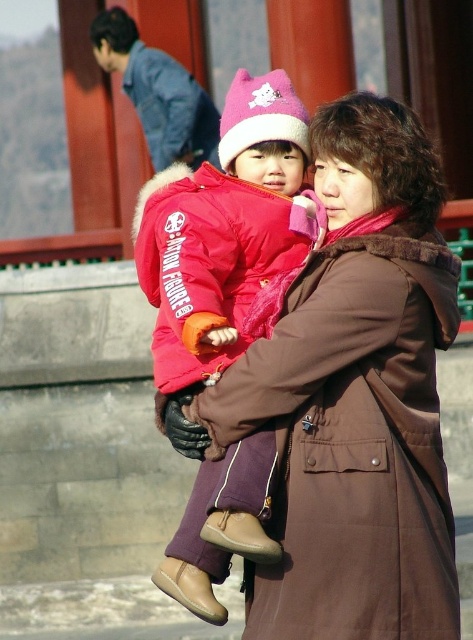
Which is behind, point (352, 328) or point (134, 248)?

The point (134, 248) is more distant.

I want to click on brown matte coat at center, so click(x=352, y=444).

Between matte red jacket at center and matte pink jacket at center, which one has less height?

With less height is matte pink jacket at center.

Does matte red jacket at center appear over matte pink jacket at center?

Incorrect, matte red jacket at center is not positioned above matte pink jacket at center.

This screenshot has height=640, width=473. What do you see at coordinates (226, 230) in the screenshot?
I see `matte red jacket at center` at bounding box center [226, 230].

I want to click on matte red jacket at center, so (226, 230).

Image resolution: width=473 pixels, height=640 pixels. In order to click on brown matte coat at center in this screenshot , I will do `click(352, 444)`.

Who is taller, brown matte coat at center or matte red jacket at center?

matte red jacket at center

The width and height of the screenshot is (473, 640). What do you see at coordinates (352, 444) in the screenshot?
I see `brown matte coat at center` at bounding box center [352, 444].

Image resolution: width=473 pixels, height=640 pixels. Find the location of `brown matte coat at center`. brown matte coat at center is located at coordinates (352, 444).